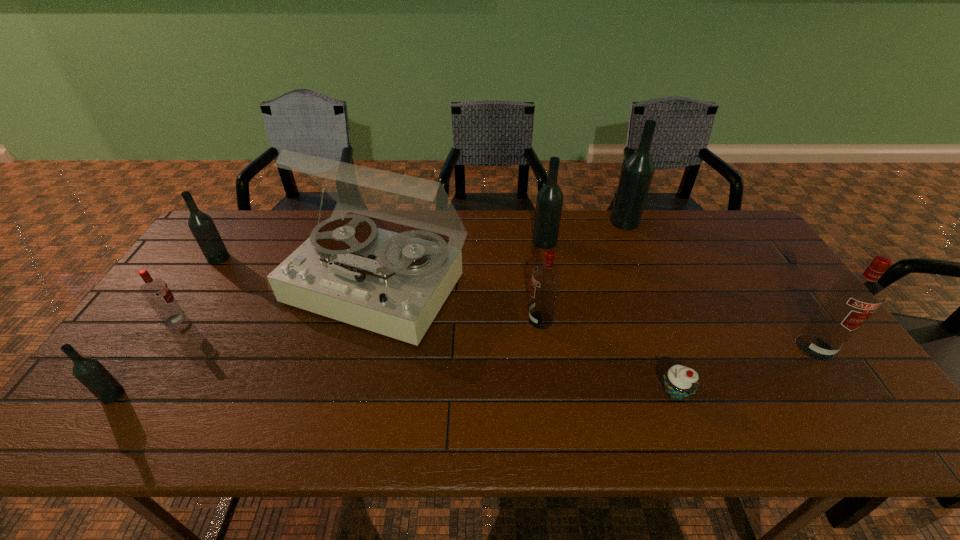
The image size is (960, 540). What are the coordinates of `blank area located 0.220m on the front label of the second red vodka from left to right` in the screenshot? It's located at (446, 320).

Where is `vacant position located on the front label of the second red vodka from left to right`? vacant position located on the front label of the second red vodka from left to right is located at coordinates (428, 320).

Locate an element on the screen. vacant point located on the front label of the second red vodka from left to right is located at coordinates (428, 320).

At what (x,y) coordinates should I click in order to perform the action: click on vacant space located 0.060m on the front label of the smallest red vodka. Please return your answer as a coordinate pair (x, y). Looking at the image, I should click on (208, 320).

Identify the location of free space located on the back of the smallest black vodka. This screenshot has width=960, height=540. (159, 328).

Identify the location of free space located on the right of the shortest object. (717, 392).

This screenshot has width=960, height=540. I want to click on record player that is positioned at the far edge, so click(x=394, y=284).

Where is `object that is positioned at the near edge`? The height and width of the screenshot is (540, 960). object that is positioned at the near edge is located at coordinates (680, 382).

Locate an element on the screen. The height and width of the screenshot is (540, 960). object at the right edge is located at coordinates (853, 298).

I want to click on object located at the far left corner, so tap(201, 225).